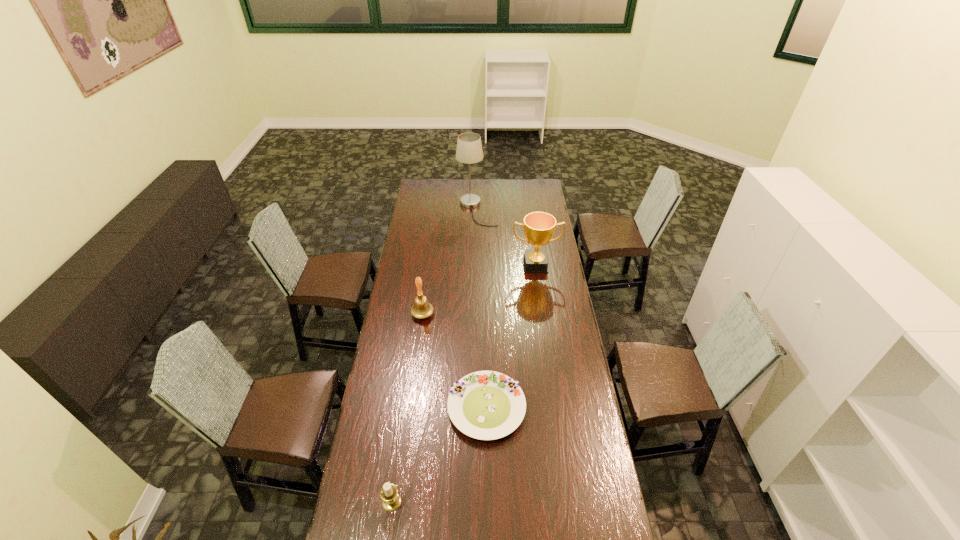
I want to click on free space in the image that satisfies the following two spatial constraints: 1. on the back side of the fourth tallest object; 2. on the right side of the fourth farthest object, so click(405, 408).

Identify the location of free spot that satisfies the following two spatial constraints: 1. on the back side of the table lamp; 2. on the left side of the third farthest object. The width and height of the screenshot is (960, 540). (436, 211).